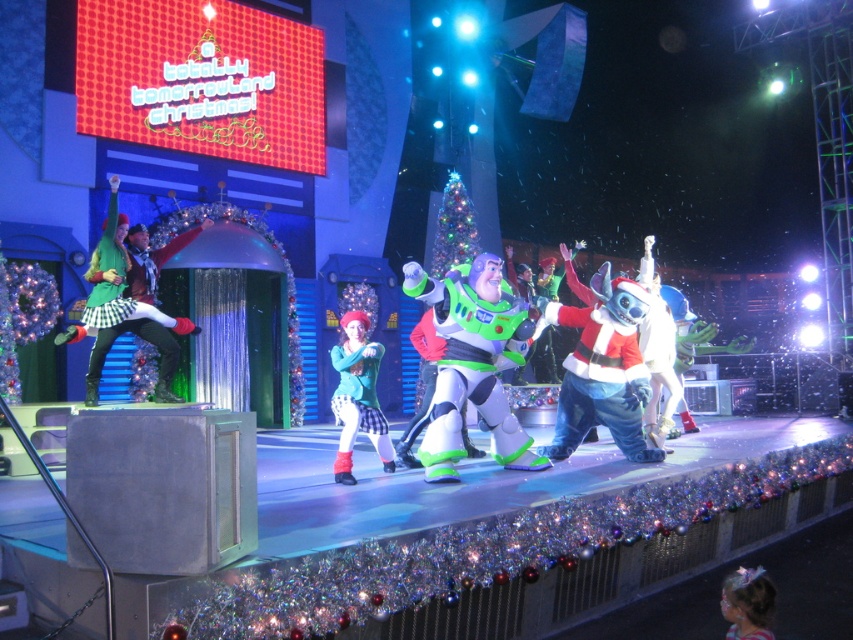
Question: Considering the relative positions of sparkly tinsel garland at stage front and green felt elf at left in the image provided, where is sparkly tinsel garland at stage front located with respect to green felt elf at left?

Choices:
 (A) right
 (B) left

Answer: (A)

Question: Among these points, which one is nearest to the camera?

Choices:
 (A) (564, 387)
 (B) (364, 358)
 (C) (286, 600)
 (D) (438, 460)

Answer: (C)

Question: Based on their relative distances, which object is farther from the sparkly tinsel garland at stage front?

Choices:
 (A) white plush toy at center
 (B) white plush santa at center
 (C) green felt elf at left

Answer: (C)

Question: Does sparkly tinsel garland at stage front have a greater width compared to white plush toy at center?

Choices:
 (A) yes
 (B) no

Answer: (A)

Question: Is green felt elf at left further to camera compared to pastel pink hairband at lower right?

Choices:
 (A) yes
 (B) no

Answer: (A)

Question: Which point is farther from the camera taking this photo?

Choices:
 (A) (540, 561)
 (B) (605, 394)

Answer: (B)